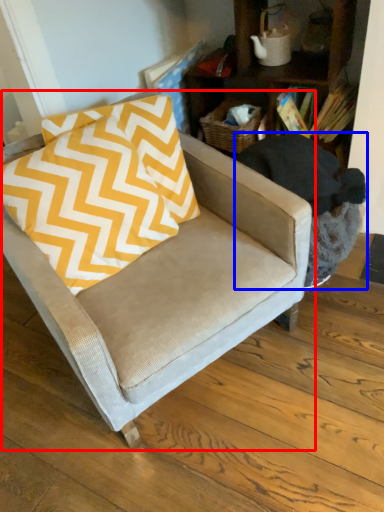
Question: Which of the following is the closest to the observer, chair (highlighted by a red box) or swivel chair (highlighted by a blue box)?

Choices:
 (A) chair
 (B) swivel chair

Answer: (A)